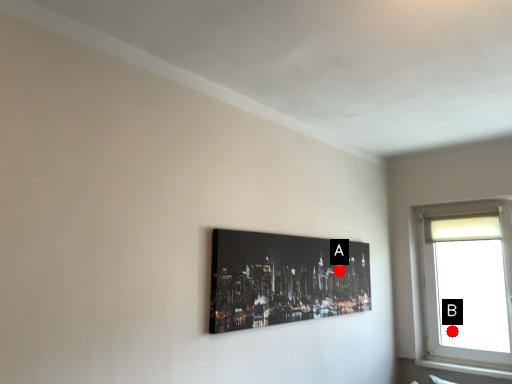
Question: Two points are circled on the image, labeled by A and B beside each circle. Among these points, which one is farthest from the camera?

Choices:
 (A) A is further
 (B) B is further

Answer: (B)